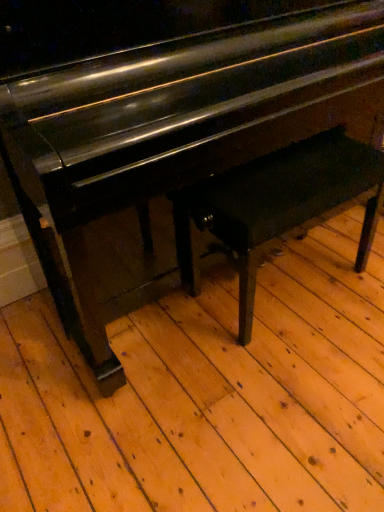
This screenshot has width=384, height=512. I want to click on free spot above black polished wood music stool at center (from a real-world perspective), so click(x=298, y=163).